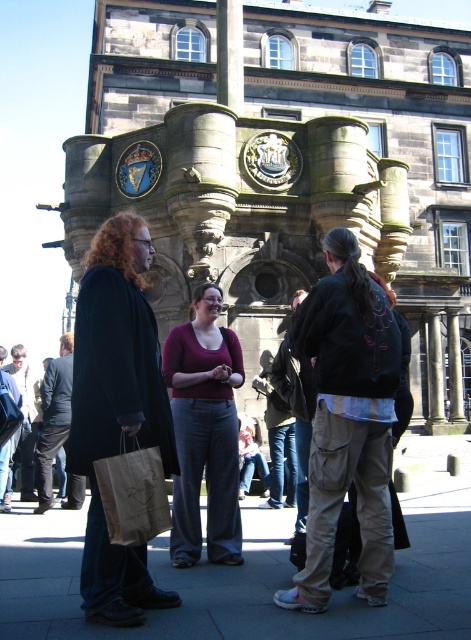
You are a photographer trying to capture a photo of the historic stone building with the two people in the foreground. Since you want both the matte black coat at left and the matte burgundy sweater at center to be clearly visible in the photo, will you need to adjust their positions to ensure neither is blocking the other?

The matte black coat at left is in front of the matte burgundy sweater at center, so to ensure both are clearly visible without obstruction, you should ask the person in the matte black coat at left to move slightly backward or to the side so the person in the matte burgundy sweater at center can be seen properly.

You are a delivery person trying to walk through the area shown in the image. The path is the concrete pavement at center. There is a matte black coat at left blocking part of the path. Can you pass through the path without stepping off it?

The concrete pavement at center is wider than the matte black coat at left, so you can pass through the path without stepping off it by moving around the matte black coat at left.